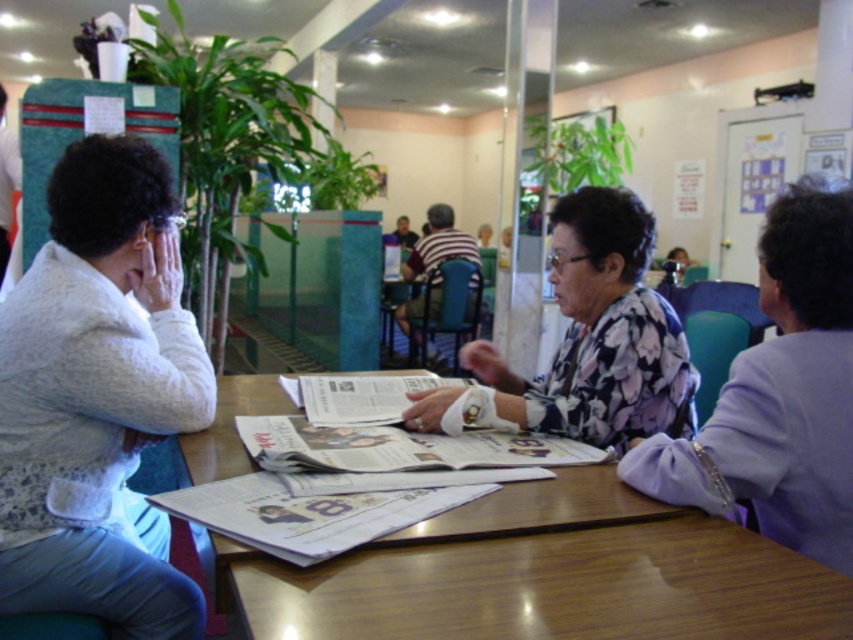
Question: Which of the following is the closest to the observer?

Choices:
 (A) (13, 401)
 (B) (714, 433)
 (C) (428, 298)
 (D) (4, 218)

Answer: (B)

Question: Which object is closer to the camera taking this photo?

Choices:
 (A) floral fabric blouse at center
 (B) smooth skin face at center
 (C) floral print blouse at center

Answer: (A)

Question: Where is matte black jacket at left located in relation to smooth skin face at center in the image?

Choices:
 (A) right
 (B) left

Answer: (B)

Question: Is wooden table at center closer to camera compared to matte black jacket at left?

Choices:
 (A) yes
 (B) no

Answer: (A)

Question: Is wooden table at center positioned behind matte black jacket at left?

Choices:
 (A) yes
 (B) no

Answer: (B)

Question: Estimate the real-world distances between objects in this image. Which object is farther from the matte black jacket at left?

Choices:
 (A) smooth skin face at center
 (B) floral print blouse at center
 (C) white textured sweater at left

Answer: (A)